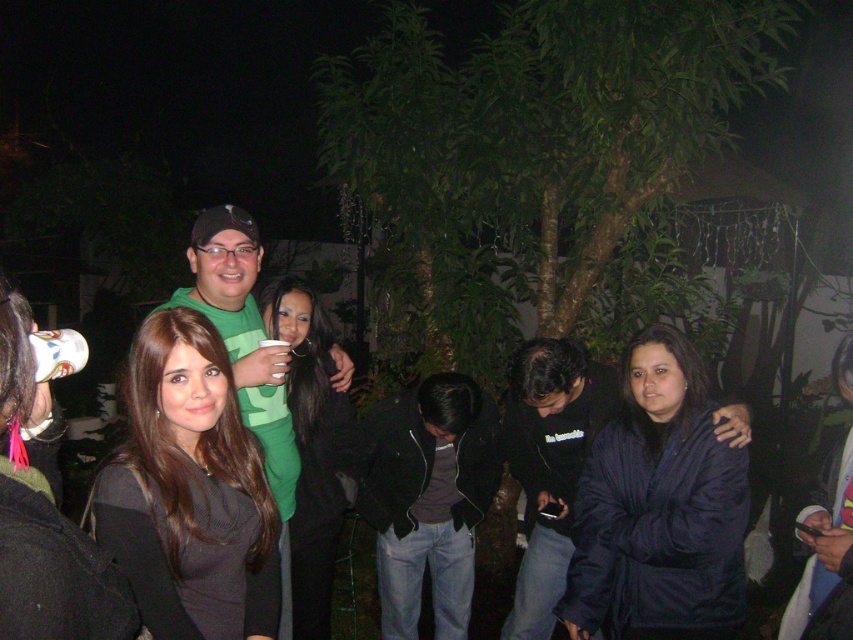
You are a photographer trying to capture a clear shot of the black matte dress at center and the shiny black hair at center. Since the lighting is dim, you want to ensure both are visible. Which object should you focus on first to ensure it is fully in frame?

The black matte dress at center has a lesser height compared to shiny black hair at center, so you should focus on the shiny black hair at center first because it is taller and more likely to be fully visible in the frame.

You are organizing a photo shoot and need to arrange two outfits in a row. The outfits are the black matte dress at center and the green matte shirt at center. If you want to place the taller outfit first, which one should you put first?

The green matte shirt at center is taller than the black matte dress at center, so you should place the green matte shirt at center first.

You are at a party and want to take a photo of the shiny black hair at center and the green matte shirt at center. Which object should you focus on first if you want to capture both clearly in the same frame?

The shiny black hair at center has a smaller size compared to the green matte shirt at center, so you should focus on the green matte shirt at center first to ensure both are in focus.